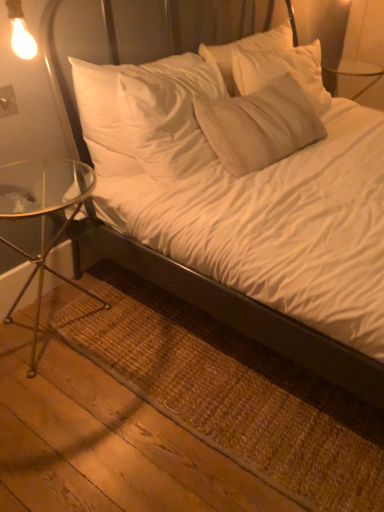
You are a GUI agent. You are given a task and a screenshot of the screen. Output one action in this format:
    pyautogui.click(x=<x>, y=<y>)
    Task: Click on the empty space that is to the right of clear glass table at left
    This screenshot has height=512, width=384.
    Given the screenshot: What is the action you would take?
    pyautogui.click(x=145, y=350)